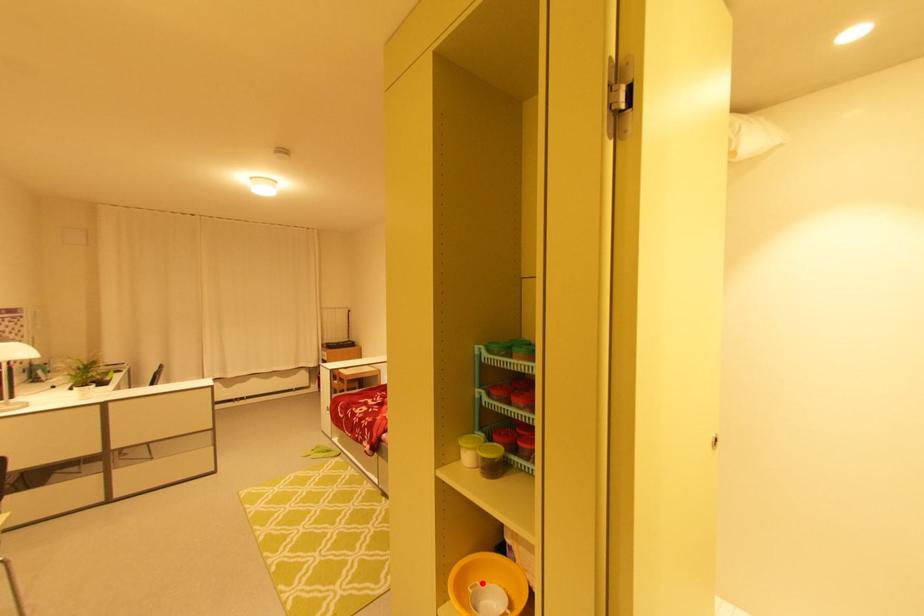
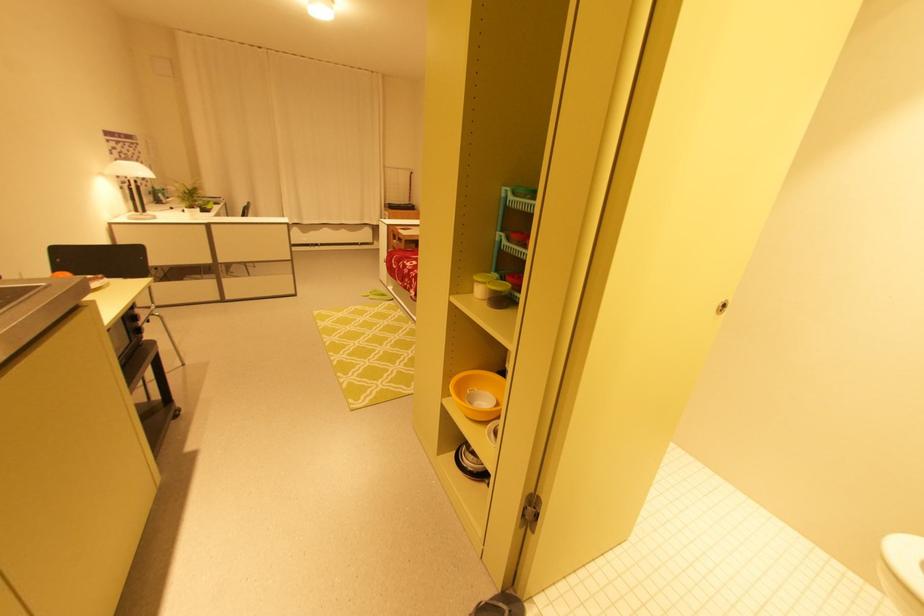
In the second image, find the point that corresponds to the highlighted location in the first image.

(480, 390)